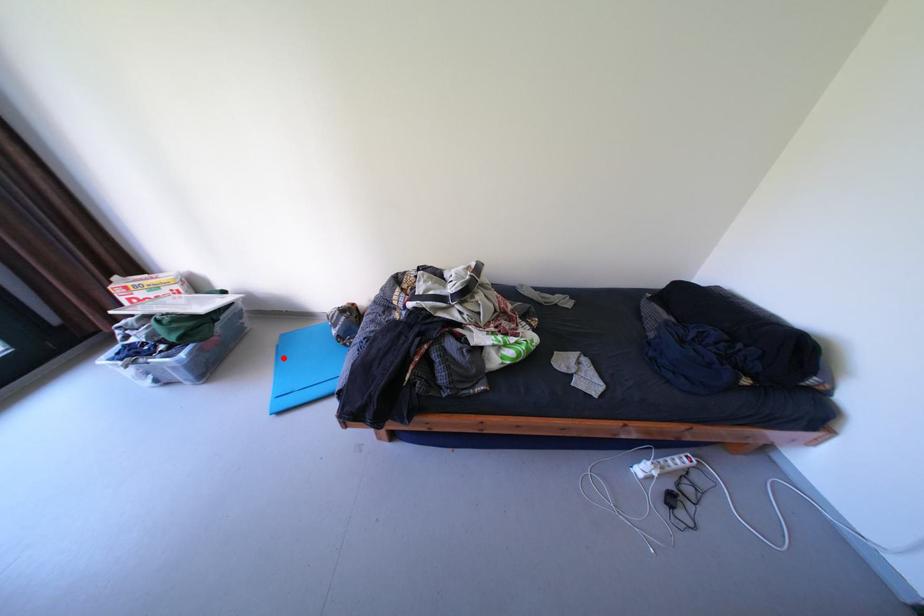
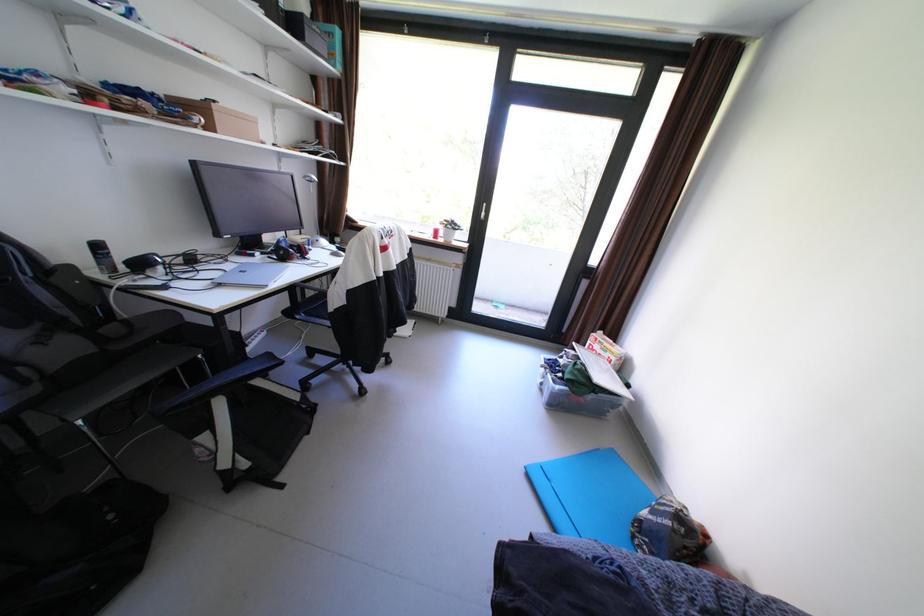
The point at the highlighted location is marked in the first image. Where is the corresponding point in the second image?

(594, 450)